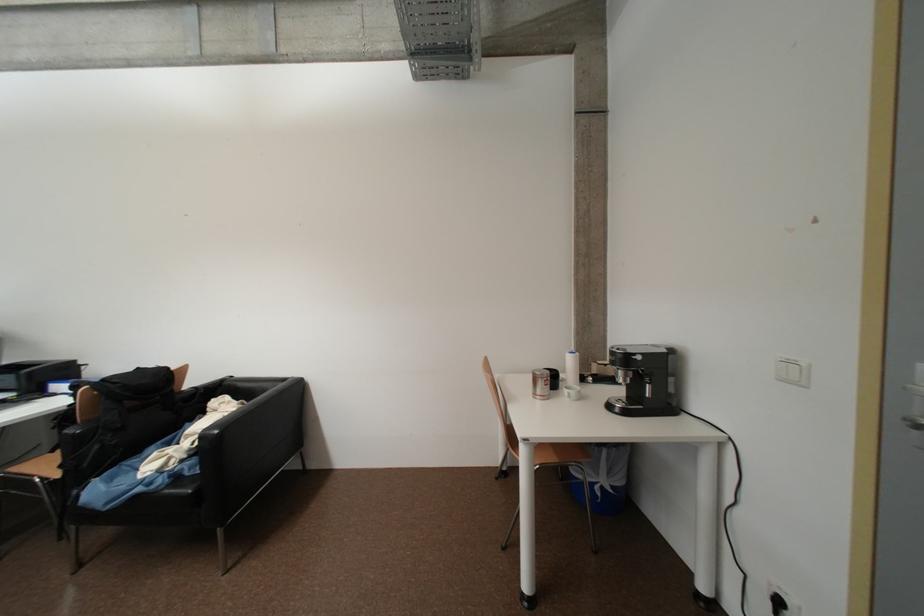
The location [643,379] corresponds to which object?

This point indicates the black coffee tamper.